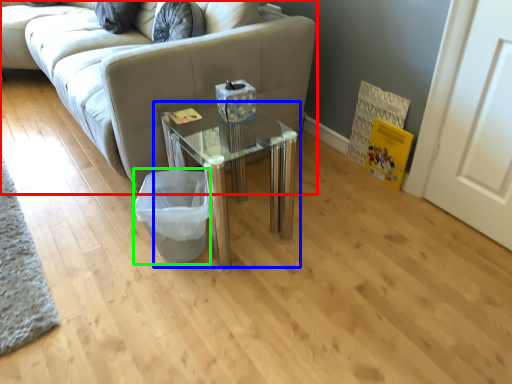
Question: Based on their relative distances, which object is farther from studio couch (highlighted by a red box)? Choose from table (highlighted by a blue box) and laundry basket (highlighted by a green box).

Choices:
 (A) table
 (B) laundry basket

Answer: (B)